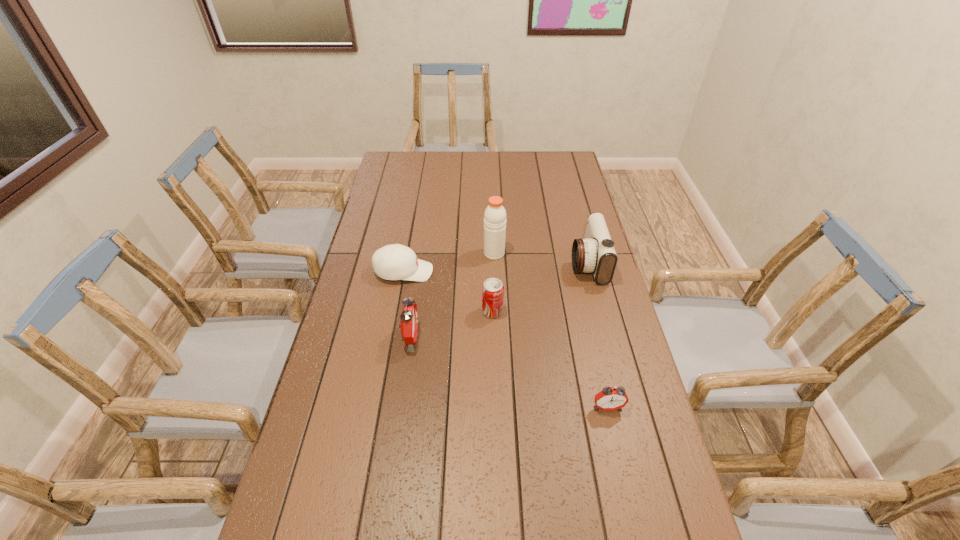
Please point a space for a new alarm_clock to maintain equal intervals. Please provide its 2D coordinates. Your answer should be formatted as a tuple, i.e. [(x, y)], where the tuple contains the x and y coordinates of a point satisfying the conditions above.

[(502, 370)]